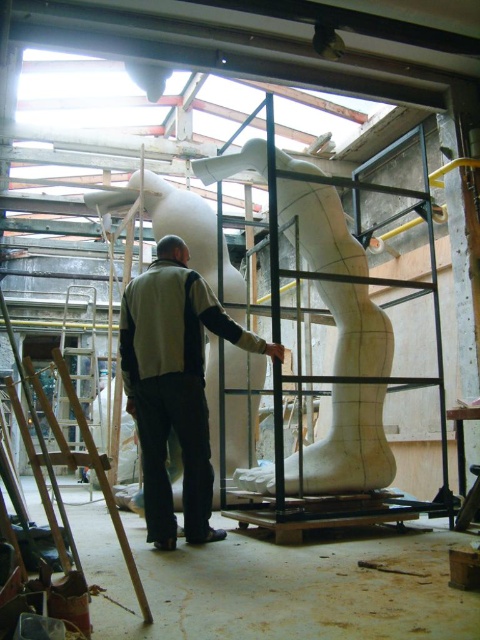
You are an artist preparing to work on the sculpture in the workshop. You have a light gray fabric jacket at center and a white marble sculpture at center in your view. Which object would require more space to store if you decide to put them away separately?

The white marble sculpture at center requires more space to store because it is larger than the light gray fabric jacket at center.

You are standing in the workshop and want to move from the point at coordinates point (217, 310) to the point at coordinates point (68, 348). Which direction should you move to reach your destination?

To move from point (217, 310) to point (68, 348), you should move downward and to the right because the destination point is lower and further to the right compared to the starting point.

You are an artist in the workshop and need to place a new tool on the floor between the light gray fabric jacket at center and the white marble sculpture at center. Can you fit the tool between them if the tool requires 1 meter of space?

The light gray fabric jacket at center is narrower than the white marble sculpture at center. Since the jacket is narrower, the space between them might be sufficient for the tool, but the exact distance isn